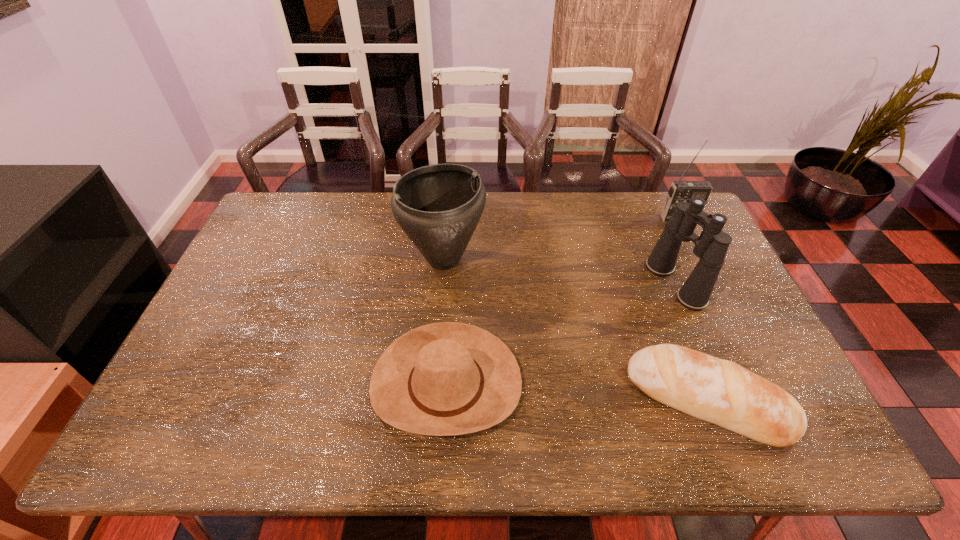
This screenshot has height=540, width=960. Find the location of `free location at the left edge of the desktop`. free location at the left edge of the desktop is located at coordinates (265, 240).

Locate an element on the screen. The width and height of the screenshot is (960, 540). free location at the right edge is located at coordinates (703, 313).

At what (x,y) coordinates should I click in order to perform the action: click on free space at the far left corner. Please return your answer as a coordinate pair (x, y). Looking at the image, I should click on (314, 192).

Image resolution: width=960 pixels, height=540 pixels. I want to click on vacant region between the cowboy hat and the urn, so click(x=444, y=322).

Find the location of a particular element. Image resolution: width=960 pixels, height=540 pixels. unoccupied position between the binoculars and the bread is located at coordinates (691, 342).

At what (x,y) coordinates should I click in order to perform the action: click on empty location between the cowboy hat and the farthest object. Please return your answer as a coordinate pair (x, y). The image size is (960, 540). Looking at the image, I should click on (563, 301).

The image size is (960, 540). Identify the location of free space between the urn and the cowboy hat. (444, 322).

This screenshot has height=540, width=960. I want to click on vacant area that lies between the binoculars and the cowboy hat, so click(561, 334).

At what (x,y) coordinates should I click in order to perform the action: click on vacant area that lies between the cowboy hat and the farthest object. Please return your answer as a coordinate pair (x, y). Image resolution: width=960 pixels, height=540 pixels. Looking at the image, I should click on (563, 301).

You are a GUI agent. You are given a task and a screenshot of the screen. Output one action in this format:
    pyautogui.click(x=<x>, y=<y>)
    Task: Click on the empty space between the urn and the farthest object
    The image size is (960, 540).
    Given the screenshot: What is the action you would take?
    pyautogui.click(x=562, y=239)